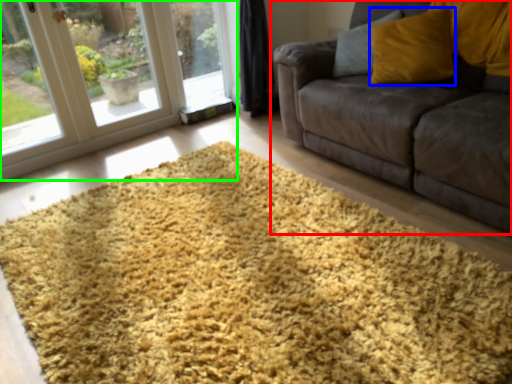
Question: Considering the real-world distances, which object is farthest from studio couch (highlighted by a red box)? throw pillow (highlighted by a blue box) or window (highlighted by a green box)?

Choices:
 (A) throw pillow
 (B) window

Answer: (B)